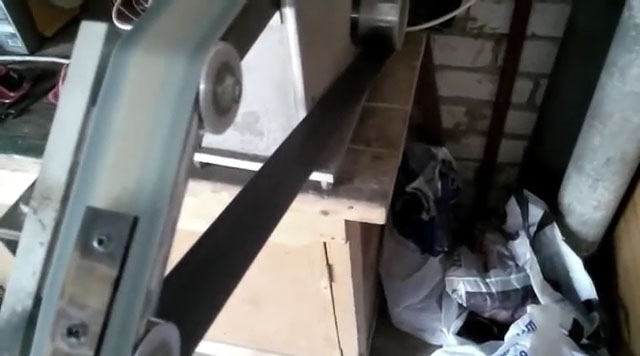
You are a GUI agent. You are given a task and a screenshot of the screen. Output one action in this format:
    pyautogui.click(x=<x>, y=<y>)
    Task: Click on the floor
    The image size is (640, 356).
    Given the screenshot: What is the action you would take?
    pyautogui.click(x=31, y=128)